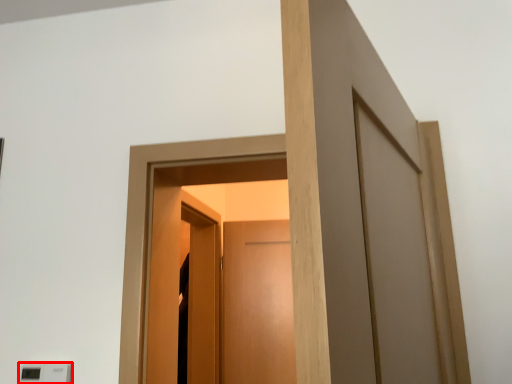
Question: From the image's perspective, what is the correct spatial positioning of light switch (annotated by the red box) in reference to screen door?

Choices:
 (A) above
 (B) below

Answer: (A)